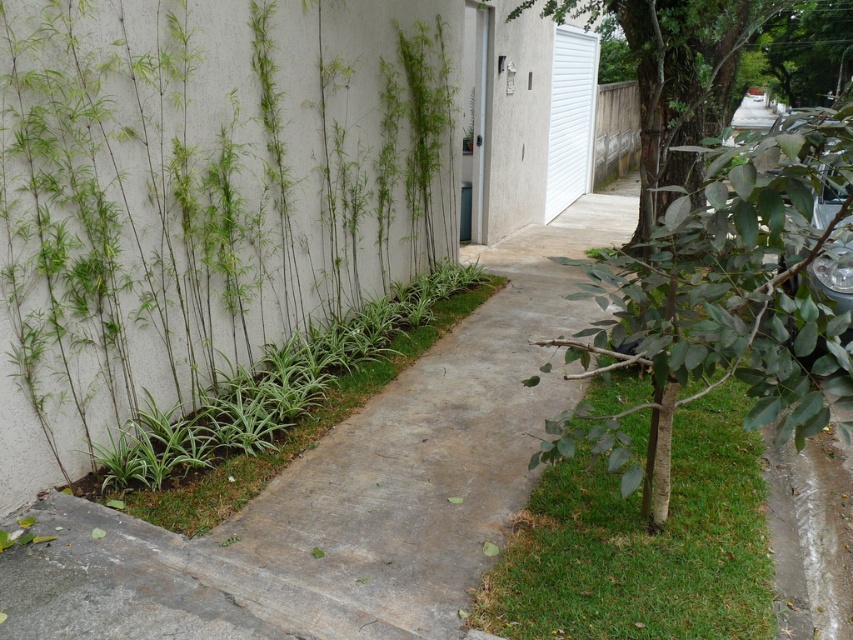
Does green bamboo at left have a greater width compared to green grass at center?

No, green bamboo at left is not wider than green grass at center.

Is green bamboo at left in front of green grass at center?

No, green bamboo at left is further to the viewer.

Describe the element at coordinates (198, 198) in the screenshot. The height and width of the screenshot is (640, 853). I see `green bamboo at left` at that location.

I want to click on green bamboo at left, so click(x=198, y=198).

Can you confirm if green bamboo at left is smaller than green leafy tree at right?

No, green bamboo at left is not smaller than green leafy tree at right.

Can you confirm if green bamboo at left is thinner than green leafy tree at right?

Incorrect, green bamboo at left's width is not less than green leafy tree at right's.

The width and height of the screenshot is (853, 640). What do you see at coordinates (198, 198) in the screenshot?
I see `green bamboo at left` at bounding box center [198, 198].

This screenshot has height=640, width=853. I want to click on green bamboo at left, so click(x=198, y=198).

Can you confirm if green leafy tree at right is positioned to the right of green grass at center?

No, green leafy tree at right is not to the right of green grass at center.

Does green leafy tree at right have a lesser width compared to green grass at center?

Yes, green leafy tree at right is thinner than green grass at center.

Is point (839, 125) positioned before point (560, 563)?

Yes, point (839, 125) is closer to viewer.

Identify the location of green leafy tree at right. The width and height of the screenshot is (853, 640). (726, 232).